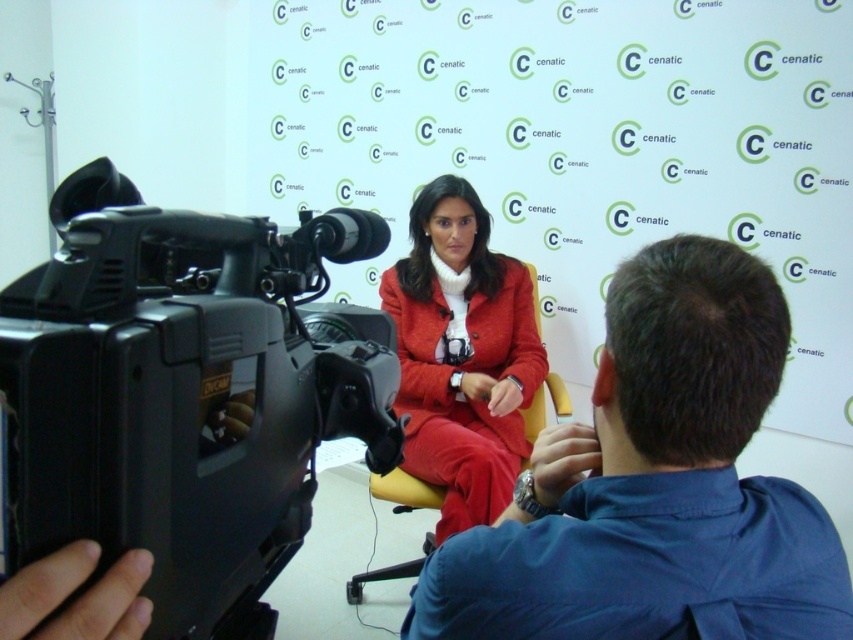
You are a photographer setting up a shoot in the scene described. You need to place a small reflector to the right of the point marked at coordinate (654, 484). Will the reflector be placed to the right of the blue cotton shirt at center?

The point at coordinate (654, 484) indicates the location of the blue cotton shirt at center. Placing the reflector to the right of this point would position it to the right of the blue cotton shirt at center.

You are a photographer standing at the viewer position. You want to place a small sticker on the exact point where the point at coordinates (764, 339) is located. The sticker has a diameter of 1.5 inches. Will the sticker fit without overlapping any other objects in the scene?

The distance between the point at coordinates (764, 339) and the viewer is 25.52 inches. The sticker has a diameter of 1.5 inches. Since the distance is much larger than the sticker size, there is sufficient space, so the sticker will fit without overlapping other objects.

You are setting up a photo shoot and need to ensure that both the black plastic video camera at left and the blue cotton shirt at center are visible in the frame. Based on their positions and sizes, can you confirm if the camera will fit within the frame if the shirt is already centered?

The black plastic video camera at left might be wider than the blue cotton shirt at center, so there is a possibility that the camera could extend beyond the frame if the shirt is centered. Adjust the camera position to ensure both fit properly.